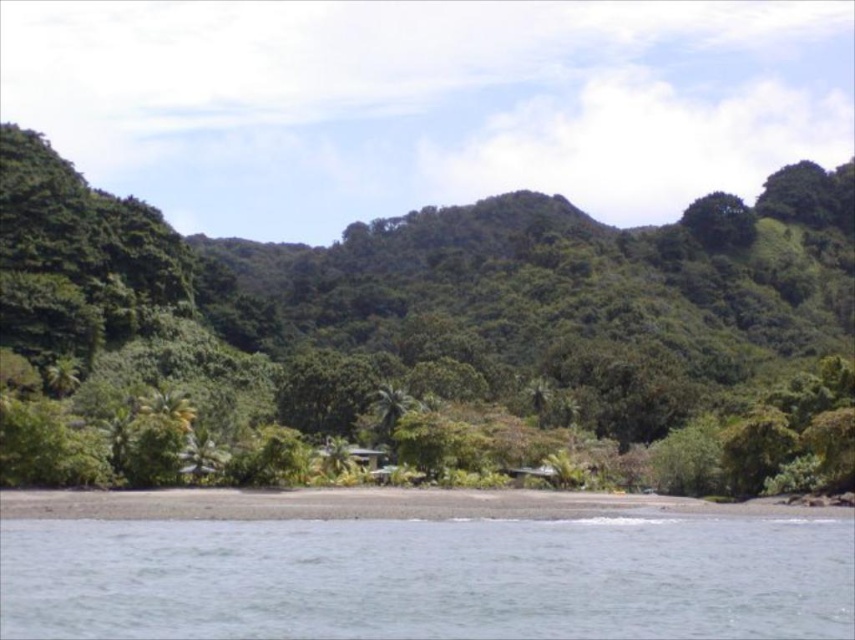
You are standing at the center of the beach and see the green leafy tree at center. Can you walk directly towards it without crossing any obstacles?

Yes, you can walk directly towards the green leafy tree at center without crossing any obstacles because it is located at point (422,332), which is directly in front of you.